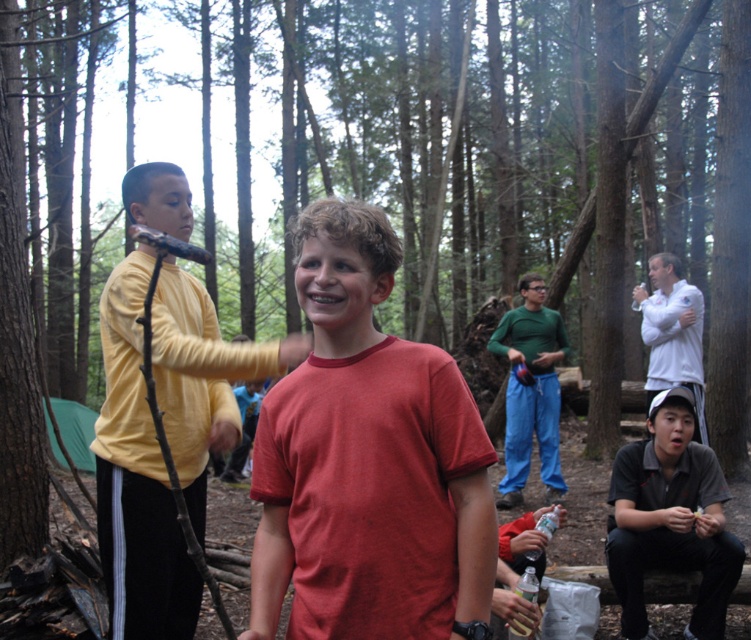
You are planning to set up a tent between the yellow fleece jacket at left and the white matte shirt at right. The tent requires a minimum of 3 meters of space. Can you determine if there is enough space between them to set up the tent?

The distance between the yellow fleece jacket at left and the white matte shirt at right is 4.09 meters, which is more than the required 3 meters. Therefore, there is enough space to set up the tent between them.

You are planning to take a photo of the two boys in the forest scene. The green fabric pants at center and the white matte shirt at right are both in the frame. Which object should you focus on if you want to capture the larger subject?

The white matte shirt at right should be focused on because it occupies more space than the green fabric pants at center.